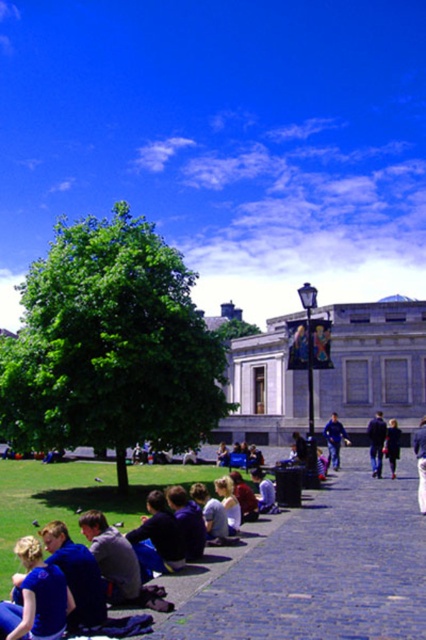
Question: Which is farther from the dark blue jacket at center?

Choices:
 (A) green grass at lower left
 (B) blue fabric shirt at lower left
 (C) blue denim jeans at lower right

Answer: (B)

Question: Which of the following is the closest to the observer?

Choices:
 (A) (382, 465)
 (B) (397, 458)

Answer: (B)

Question: Considering the real-world distances, which object is closest to the green grass at lower left?

Choices:
 (A) dark blue jacket at center
 (B) dark blue shirt at lower left
 (C) blue denim jeans at lower right

Answer: (B)

Question: Does blue denim jeans at center have a lesser width compared to dark blue jacket at center?

Choices:
 (A) no
 (B) yes

Answer: (A)

Question: Can you confirm if blue fabric shirt at lower left is wider than dark blue jeans at center?

Choices:
 (A) no
 (B) yes

Answer: (A)

Question: Can you confirm if blue fabric shirt at lower left is thinner than blue denim jeans at center?

Choices:
 (A) yes
 (B) no

Answer: (A)